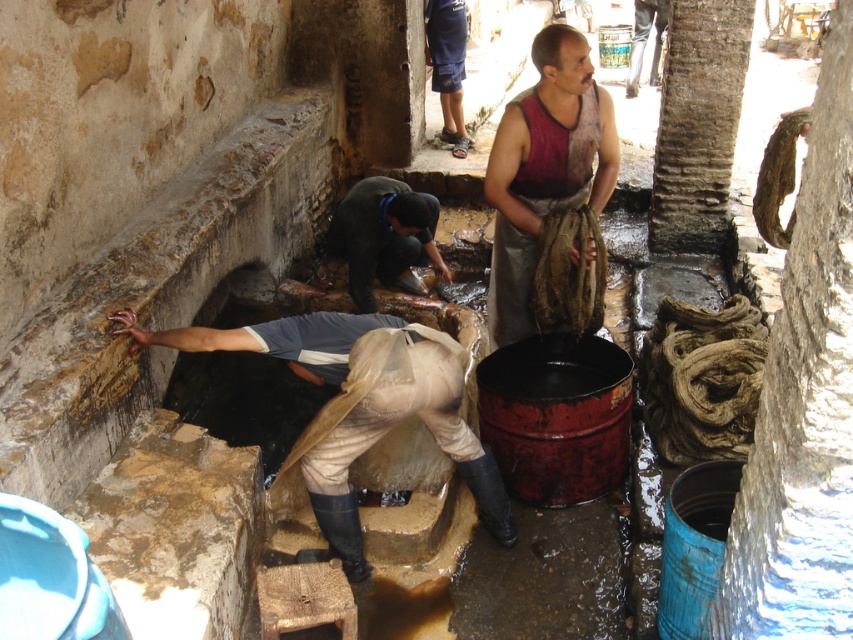
You are standing at the entrance of the tannery and see two points marked in the scene. Which point is closer to you, point (x=366, y=310) or point (x=459, y=100)?

Point (x=366, y=310) is in front of point (x=459, y=100), so it is closer to you.

You are a tailor trying to decide which garment to use for a project. Given the dark red sleeveless shirt at center and the dark blue denim shorts at center, which one has a greater width?

The dark red sleeveless shirt at center has a greater width than the dark blue denim shorts at center.